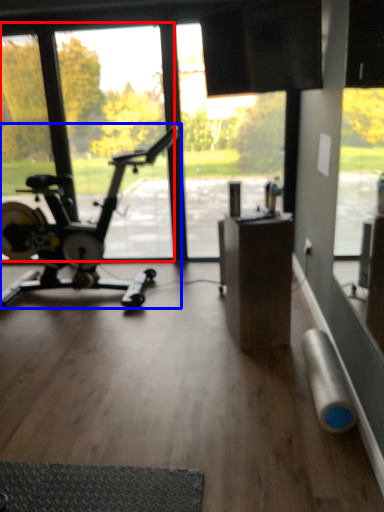
Question: Which of the following is the farthest to the observer, window screen (highlighted by a red box) or stationary bicycle (highlighted by a blue box)?

Choices:
 (A) window screen
 (B) stationary bicycle

Answer: (A)